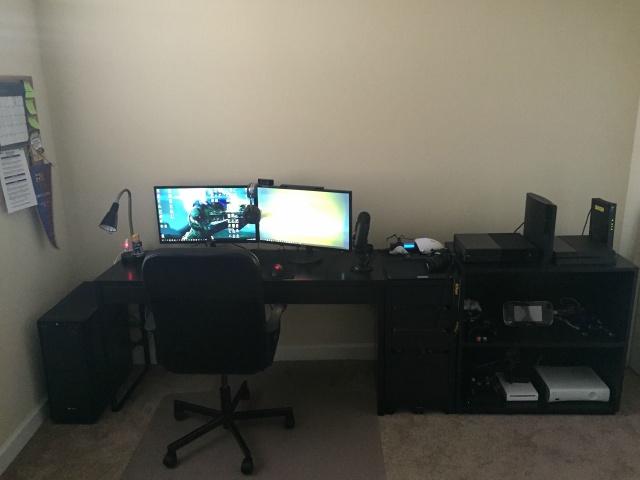
Locate an element on the screen. The height and width of the screenshot is (480, 640). desk lamp is located at coordinates (113, 222).